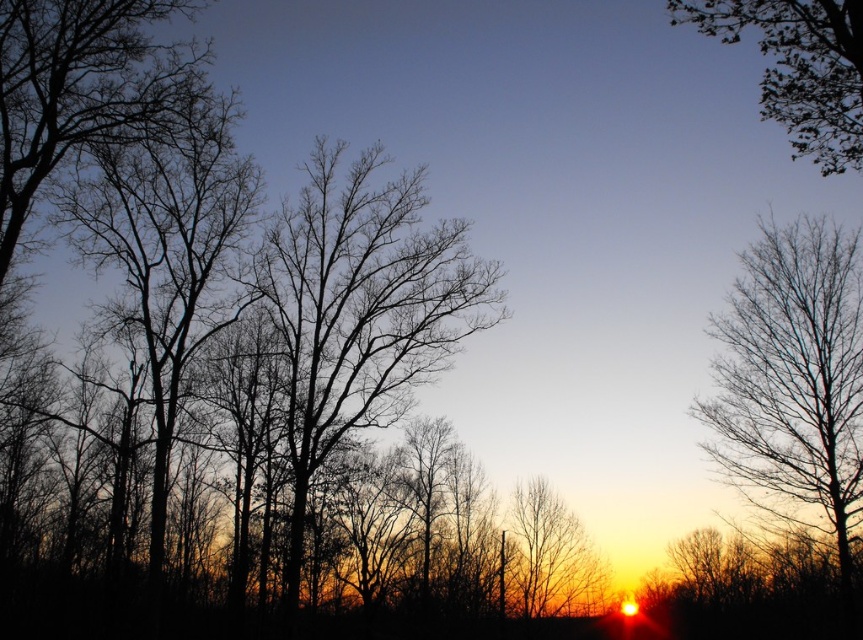
You are standing in the serene sunset scene and notice a specific point marked at coordinates point [372,326]. If you want to reach this point without moving closer than 100 feet from your current position, can you safely walk towards it?

The point [372,326] is 92.70 feet away from the viewer, which is less than 100 feet. Therefore, walking towards it would bring you closer than the 100 feet limit, so you cannot safely walk towards it without violating the distance constraint.

You are an artist sketching the sunset scene. You want to ensure the black bare tree at center and the bare branches at left are proportionally accurate. Which object should you draw first to maintain the correct size relationship between them?

You should draw the black bare tree at center first since it is bigger than the bare branches at left, ensuring the larger structure is in place before adding smaller details.

You are an astronomer analyzing the sunset scene. You need to locate the position of the bare branches at right in the image. What are their coordinates?

The coordinates of the bare branches at right are at point [792,380].